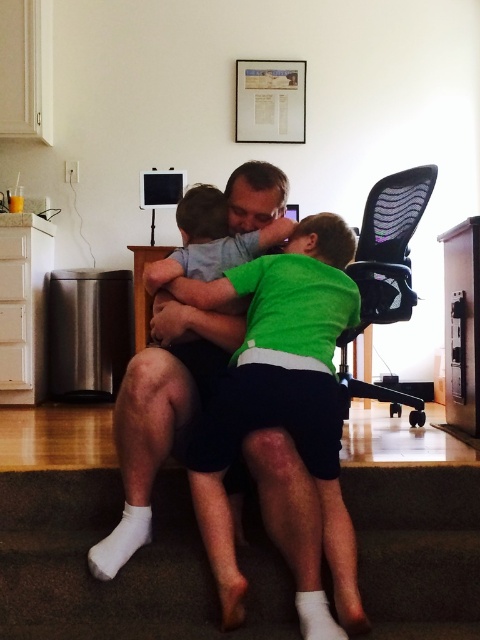
You are a delivery person entering the home office and need to place a package on the floor near the smooth skin man at center without blocking the black mesh swivel chair at right. Is the space between them sufficient for this?

The smooth skin man at center is located below the black mesh swivel chair at right, meaning there is vertical space between them. Since the package is placed on the floor, the vertical positioning allows enough space to place it near the man without blocking the chair.

In the scene shown: You are a delivery person entering the room and need to place a package on the floor between the smooth skin man at center and the black mesh swivel chair at right. Where should you place the package?

The smooth skin man at center is positioned on the left side of black mesh swivel chair at right, so you should place the package between them on the floor between the smooth skin man at center and the black mesh swivel chair at right.